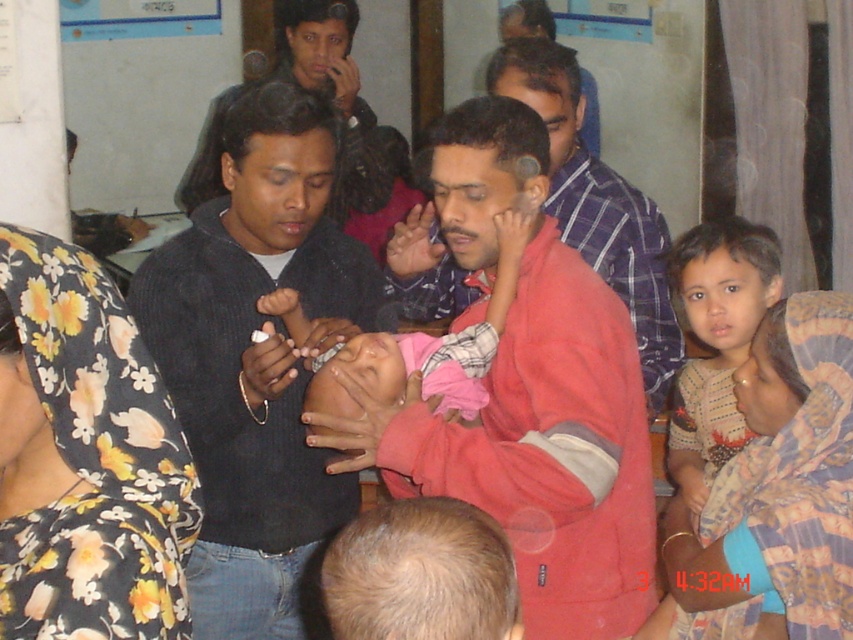
Question: Which of the following is the closest to the observer?

Choices:
 (A) floral fabric headscarf at upper left
 (B) dark gray sweater at center

Answer: (A)

Question: From the image, what is the correct spatial relationship of dark gray sweater at center in relation to floral fabric headscarf at upper left?

Choices:
 (A) left
 (B) right

Answer: (B)

Question: Does red cotton shirt at center have a larger size compared to light brown fabric shirt at right?

Choices:
 (A) yes
 (B) no

Answer: (A)

Question: Is red fleece jacket at center to the left of dark gray sweater at center from the viewer's perspective?

Choices:
 (A) yes
 (B) no

Answer: (B)

Question: Among these objects, which one is farthest from the camera?

Choices:
 (A) red cotton shirt at center
 (B) dark gray sweater at center
 (C) pink fabric baby at center
 (D) black matte sweater at upper center

Answer: (D)

Question: Which point is closer to the camera?

Choices:
 (A) dark gray sweater at center
 (B) red fleece jacket at center
 (C) printed fabric baby at center
 (D) floral fabric headscarf at upper left

Answer: (D)